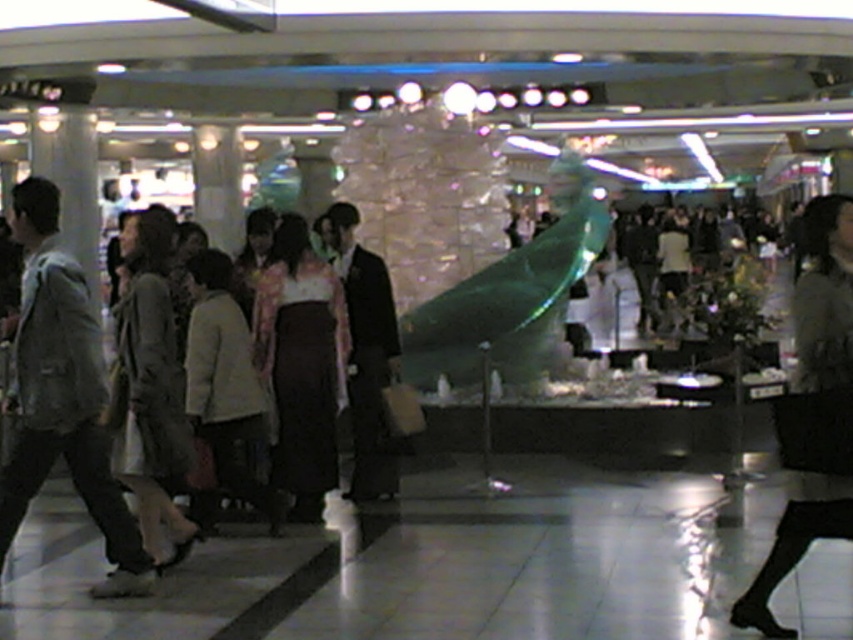
You are a photographer trying to capture both the floral kimono at center and the light beige coat at center in a single frame. Since you want to ensure both are fully visible, which clothing item should you focus on to avoid cropping due to their size difference?

The floral kimono at center is narrower than the light beige coat at center, so you should focus on framing the wider light beige coat at center to ensure it fits without cropping, which will naturally include the narrower floral kimono at center as well.

You are navigating through the shopping mall and want to reach the ice sculpture in the center. You see two points marked as point (131, 483) and point (241, 499). Which point should you head towards to get closer to the ice sculpture?

Point (131, 483) is in front of point (241, 499), so heading towards point (131, 483) will get you closer to the ice sculpture.

You are a photographer trying to capture both the light beige coat at center and the light beige fabric coat at center in one shot. Which one should you focus on first if you want to include both in your frame without moving the camera?

You should focus on the light beige coat at center first because it is positioned on the left side of the light beige fabric coat at center, so capturing it from the left will ensure both are included in the frame.